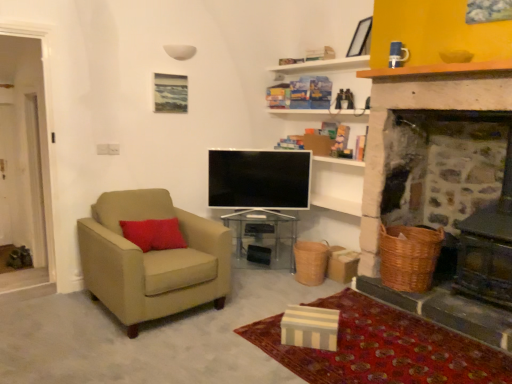
Question: Looking at the image, does flat screen tv at center seem bigger or smaller compared to transparent acrylic table at center?

Choices:
 (A) big
 (B) small

Answer: (B)

Question: From a real-world perspective, is flat screen tv at center physically located above or below transparent acrylic table at center?

Choices:
 (A) above
 (B) below

Answer: (A)

Question: Estimate the real-world distances between objects in this image. Which object is farther from the striped fabric box at lower center?

Choices:
 (A) braided wicker basket at lower center, the 1th basket when ordered from back to front
 (B) beige fabric armchair at left
 (C) matte black picture frame at upper center
 (D) flat screen tv at center
 (E) transparent acrylic table at center

Answer: (C)

Question: Estimate the real-world distances between objects in this image. Which object is farther from the braided wicker basket at lower center, which is the 1th basket in left-to-right order?

Choices:
 (A) striped fabric box at lower center
 (B) transparent acrylic table at center
 (C) woven brown basket at right, which is the 2th basket in left-to-right order
 (D) flat screen tv at center
 (E) beige fabric armchair at left

Answer: (E)